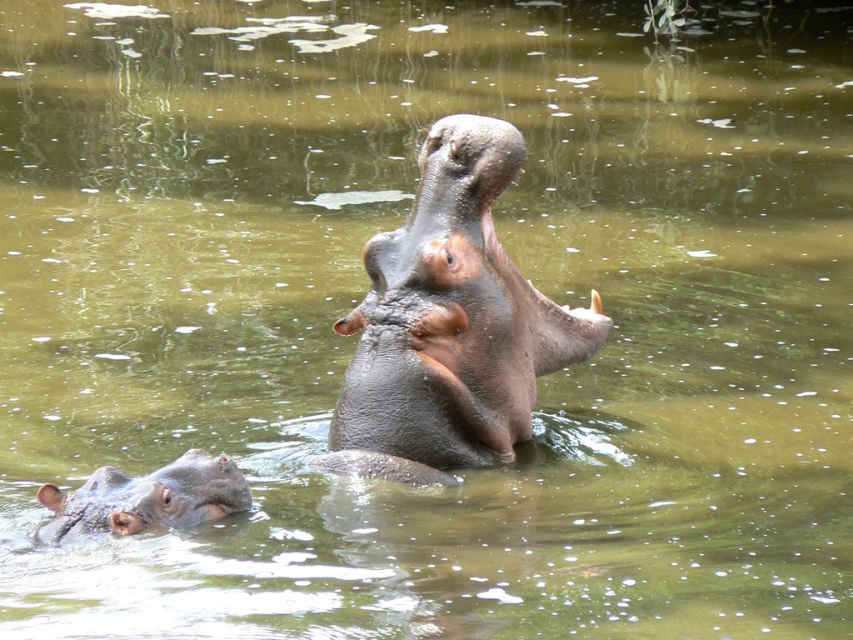
You are a photographer trying to capture both the dark gray textured hippo at center and the gray matte hippo at lower left in the same frame. Based on their positions, which hippo is closer to the left edge of the photo?

The gray matte hippo at lower left is closer to the left edge of the photo because the dark gray textured hippo at center is to the right of it.

You are a photographer trying to capture both the dark gray textured hippo at center and the gray matte hippo at lower left in a single photo. However, you can only focus on one hippo at a time. Which hippo should you focus on to ensure the other remains in the background?

You should focus on the dark gray textured hippo at center because the gray matte hippo at lower left is behind it, so focusing on the front hippo will keep the background hippo in focus as well.

You are a wildlife photographer trying to capture both hippos in a single shot. Given that your camera frame can only accommodate the size of the gray matte hippo at lower left, will you be able to fit the dark gray textured hippo at center into the frame?

The dark gray textured hippo at center is larger than the gray matte hippo at lower left. Since the camera frame can only accommodate the size of the gray matte hippo at lower left, the dark gray textured hippo at center will not fit into the frame.